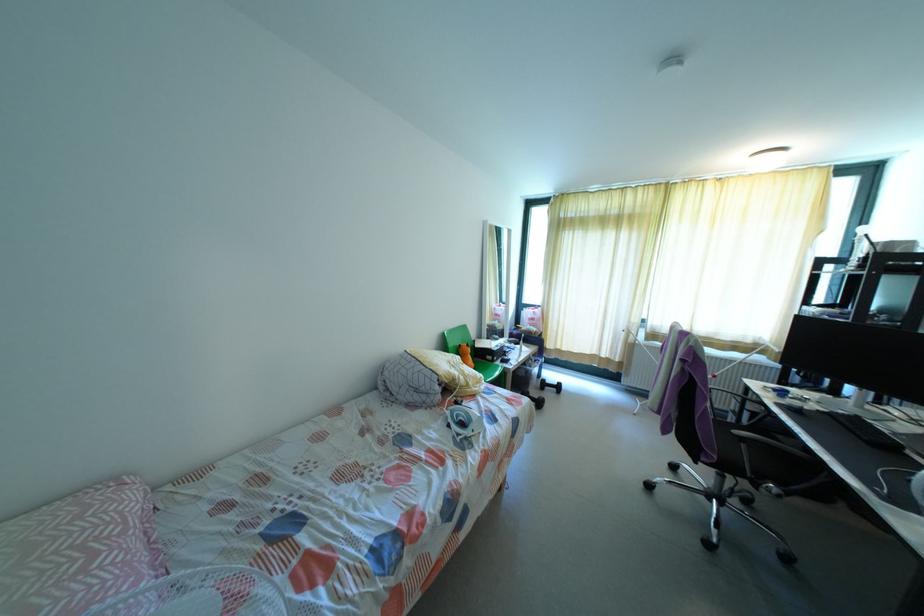
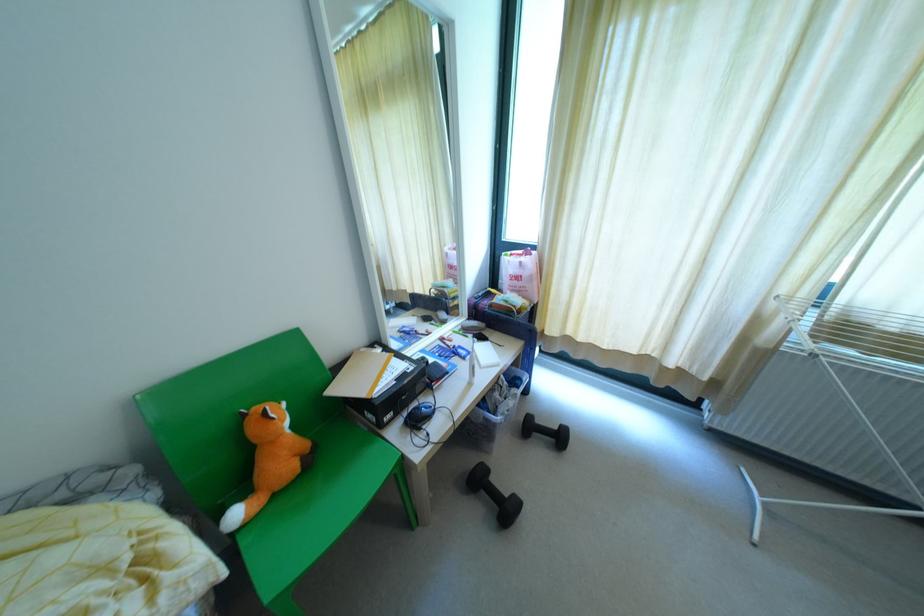
The point at (602, 355) is marked in the first image. Where is the corresponding point in the second image?

(670, 363)